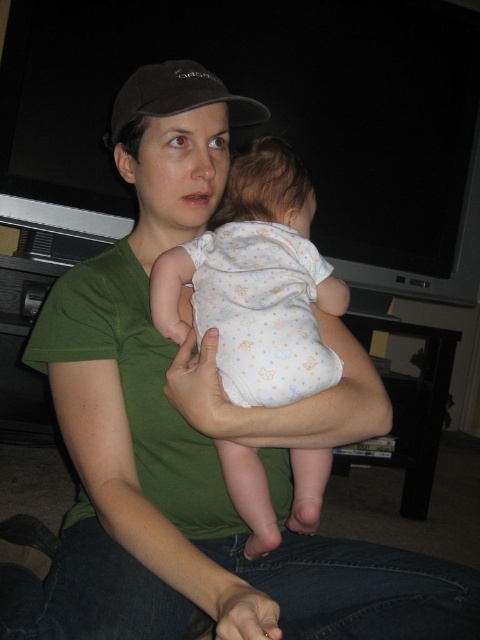
Is point (271, 541) behind point (156, 115)?

No, it is in front of (156, 115).

Which is below, white dotted fabric at center or black fabric baseball cap at upper center?

white dotted fabric at center is below.

Who is more distant from viewer, (228,444) or (155,112)?

Positioned behind is point (228,444).

Locate an element on the screen. Image resolution: width=480 pixels, height=640 pixels. white dotted fabric at center is located at coordinates (256, 284).